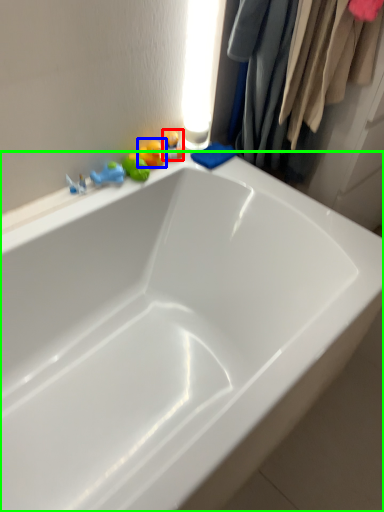
Question: Based on their relative distances, which object is farther from toy (highlighted by a red box)? Choose from toy (highlighted by a blue box) and bathtub (highlighted by a green box).

Choices:
 (A) toy
 (B) bathtub

Answer: (B)